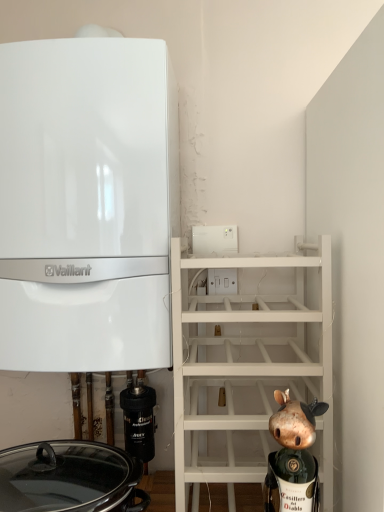
This screenshot has height=512, width=384. Identify the location of black rubber filter at lower left. (139, 420).

What do you see at coordinates (222, 281) in the screenshot? The height and width of the screenshot is (512, 384). I see `white plastic electric outlet at center` at bounding box center [222, 281].

In order to click on black glossy crock pot at lower left in this screenshot , I will do `click(70, 478)`.

Is white matte shelf at upper right not close to white plastic electric outlet at center?

No.

Is white matte shelf at upper right taller or shorter than white plastic electric outlet at center?

Considering their sizes, white matte shelf at upper right has more height than white plastic electric outlet at center.

From the picture: Is white matte shelf at upper right further to the viewer compared to white plastic electric outlet at center?

No, white matte shelf at upper right is closer to the viewer.

Where is `shelf located on the right of white plastic electric outlet at center`? shelf located on the right of white plastic electric outlet at center is located at coordinates (248, 362).

Does point (303, 508) come in front of point (125, 424)?

Yes, it is in front of point (125, 424).

Is gold metallic figurine at lower right wider than black rubber filter at lower left?

Yes, gold metallic figurine at lower right is wider than black rubber filter at lower left.

In the image, is gold metallic figurine at lower right on the left side or the right side of black rubber filter at lower left?

gold metallic figurine at lower right is to the right of black rubber filter at lower left.

How different are the orientations of black glossy crock pot at lower left and white glossy vaillant boiler at left in degrees?

0.709 degrees.

I want to click on home appliance that is behind the black glossy crock pot at lower left, so click(x=87, y=204).

Between point (35, 474) and point (123, 314), which one is positioned in front?

The point (123, 314) is closer.

Between black glossy crock pot at lower left and white glossy vaillant boiler at left, which one has larger size?

Bigger between the two is white glossy vaillant boiler at left.

Find the location of a particular element. This screenshot has height=512, width=384. home appliance that appears above the black glossy crock pot at lower left (from the image's perspective) is located at coordinates (87, 204).

Consider the image. Which is nearer, (137, 154) or (79, 497)?

Point (137, 154)

From the image's perspective, between white glossy vaillant boiler at left and black glossy crock pot at lower left, which one is located above?

white glossy vaillant boiler at left, from the image's perspective.

Would you say white glossy vaillant boiler at left is inside or outside black glossy crock pot at lower left?

white glossy vaillant boiler at left is outside black glossy crock pot at lower left.

Is white glossy vaillant boiler at left turned away from white plastic electric outlet at center?

No, white glossy vaillant boiler at left is not facing away from white plastic electric outlet at center.

Is white glossy vaillant boiler at left far away from white plastic electric outlet at center?

No, white glossy vaillant boiler at left is not far away from white plastic electric outlet at center.

Considering the relative sizes of white glossy vaillant boiler at left and white plastic electric outlet at center in the image provided, is white glossy vaillant boiler at left taller than white plastic electric outlet at center?

Yes.

In terms of width, does black glossy crock pot at lower left look wider or thinner when compared to black rubber filter at lower left?

black glossy crock pot at lower left is wider than black rubber filter at lower left.

From the image's perspective, between black glossy crock pot at lower left and black rubber filter at lower left, which one is located above?

From the image's view, black rubber filter at lower left is above.

Is point (61, 486) less distant than point (138, 409)?

Yes, point (61, 486) is in front of point (138, 409).

Which object is closer to the camera taking this photo, black glossy crock pot at lower left or black rubber filter at lower left?

black glossy crock pot at lower left is more forward.

Looking at their sizes, would you say white matte shelf at upper right is wider or thinner than gold metallic figurine at lower right?

In the image, white matte shelf at upper right appears to be wider than gold metallic figurine at lower right.

Can you confirm if white matte shelf at upper right is positioned to the right of gold metallic figurine at lower right?

No.

From the image's perspective, does white matte shelf at upper right appear higher than gold metallic figurine at lower right?

Indeed, from the image's perspective, white matte shelf at upper right is shown above gold metallic figurine at lower right.

How much distance is there between white matte shelf at upper right and gold metallic figurine at lower right?

white matte shelf at upper right and gold metallic figurine at lower right are 8.59 inches apart from each other.

Where is `shelf below the white plastic electric outlet at center (from the image's perspective)`? This screenshot has width=384, height=512. shelf below the white plastic electric outlet at center (from the image's perspective) is located at coordinates (248, 362).

This screenshot has height=512, width=384. What are the coordinates of `appliance beneath the gold metallic figurine at lower right (from a real-world perspective)` in the screenshot? It's located at (139, 420).

When comparing their distances from white glossy vaillant boiler at left, does black rubber filter at lower left or black glossy crock pot at lower left seem closer?

Based on the image, black glossy crock pot at lower left appears to be nearer to white glossy vaillant boiler at left.

From the image, which object appears to be nearer to white plastic electric outlet at center, white glossy vaillant boiler at left or white matte shelf at upper right?

white matte shelf at upper right lies closer to white plastic electric outlet at center than the other object.

From the image, which object appears to be nearer to black glossy crock pot at lower left, white matte shelf at upper right or white plastic electric outlet at center?

Among the two, white matte shelf at upper right is located nearer to black glossy crock pot at lower left.

Estimate the real-world distances between objects in this image. Which object is further from gold metallic figurine at lower right, black glossy crock pot at lower left or white glossy vaillant boiler at left?

white glossy vaillant boiler at left is positioned further to the anchor gold metallic figurine at lower right.

Considering their positions, is white plastic electric outlet at center positioned further to black rubber filter at lower left than gold metallic figurine at lower right?

gold metallic figurine at lower right is further to black rubber filter at lower left.

Considering their positions, is gold metallic figurine at lower right positioned further to white glossy vaillant boiler at left than black glossy crock pot at lower left?

The object further to white glossy vaillant boiler at left is gold metallic figurine at lower right.

Estimate the real-world distances between objects in this image. Which object is closer to gold metallic figurine at lower right, black rubber filter at lower left or white plastic electric outlet at center?

black rubber filter at lower left is closer to gold metallic figurine at lower right.

Based on their spatial positions, is gold metallic figurine at lower right or white plastic electric outlet at center closer to white matte shelf at upper right?

Based on the image, gold metallic figurine at lower right appears to be nearer to white matte shelf at upper right.

Find the location of `appliance between black glossy crock pot at lower left and gold metallic figurine at lower right from left to right`. appliance between black glossy crock pot at lower left and gold metallic figurine at lower right from left to right is located at coordinates (139, 420).

Locate an element on the screen. The image size is (384, 512). figurine between white glossy vaillant boiler at left and black glossy crock pot at lower left in the vertical direction is located at coordinates (293, 456).

Locate an element on the screen. The height and width of the screenshot is (512, 384). appliance between gold metallic figurine at lower right and white plastic electric outlet at center from front to back is located at coordinates (139, 420).

The image size is (384, 512). Identify the location of electric outlet between white glossy vaillant boiler at left and white matte shelf at upper right in the vertical direction. (222, 281).